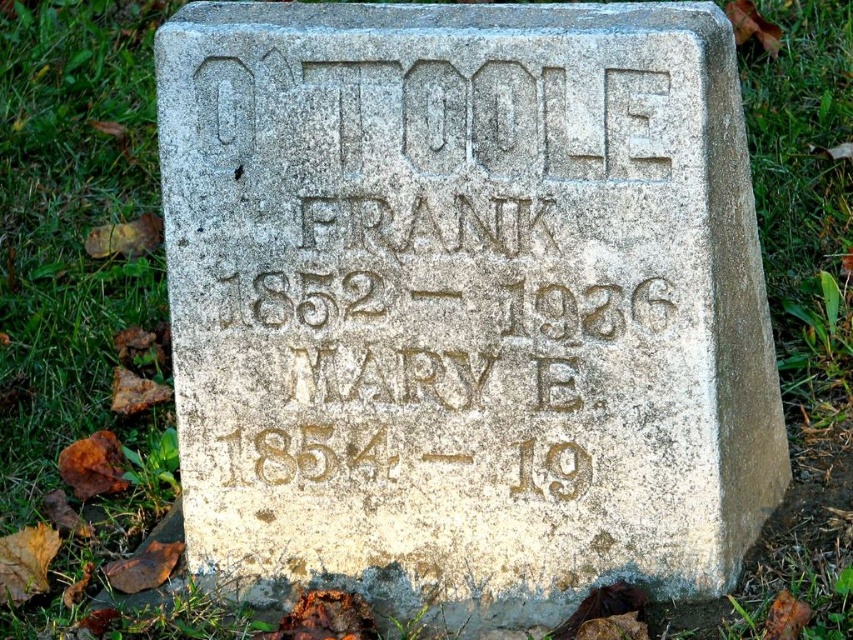
You are a historian examining the gray stone gravestone at center and the carved stone inscription at center. Which object is wider?

The gray stone gravestone at center is wider than the carved stone inscription at center.